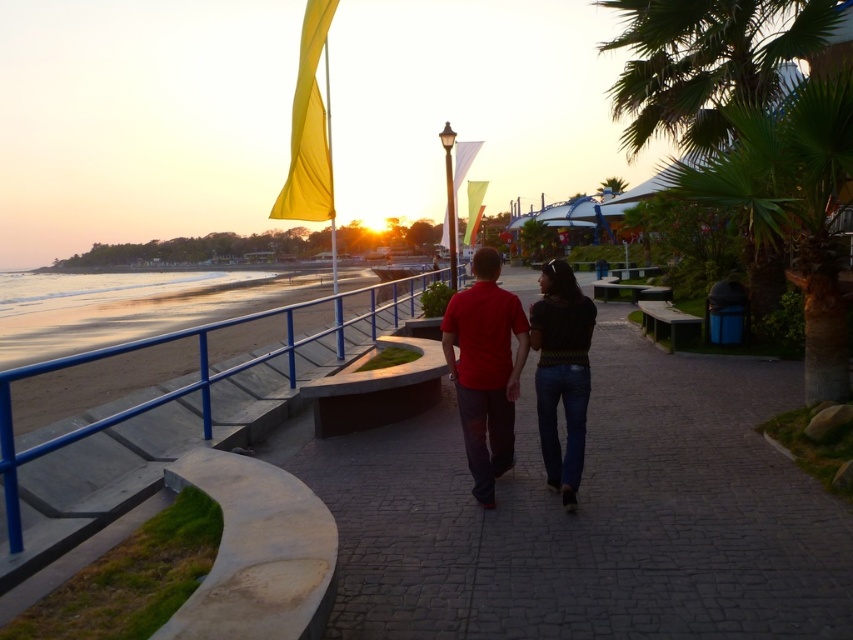
Question: Among these objects, which one is nearest to the camera?

Choices:
 (A) green leafy palm tree at upper right
 (B) matte red shirt at center
 (C) smooth concrete pavement at center
 (D) knit sweater at center

Answer: (C)

Question: Does smooth concrete pavement at center have a lesser width compared to matte red shirt at center?

Choices:
 (A) no
 (B) yes

Answer: (A)

Question: Among these objects, which one is nearest to the camera?

Choices:
 (A) smooth concrete pavement at center
 (B) matte red shirt at center

Answer: (A)

Question: Which object appears closest to the camera in this image?

Choices:
 (A) green leafy palm tree at upper right
 (B) matte red shirt at center
 (C) knit sweater at center

Answer: (C)

Question: Can you confirm if smooth concrete pavement at center is positioned above matte red shirt at center?

Choices:
 (A) no
 (B) yes

Answer: (A)

Question: Can you confirm if green leafy palm tree at upper right is wider than knit sweater at center?

Choices:
 (A) yes
 (B) no

Answer: (A)